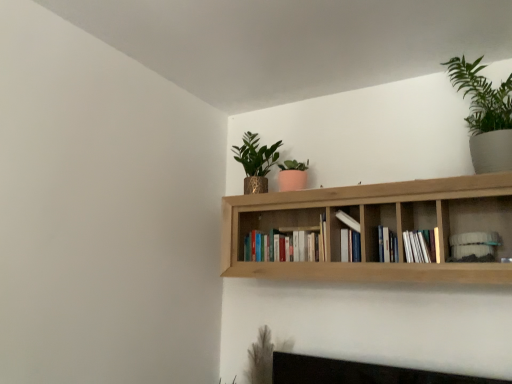
Question: Could natural wood bookshelf at upper center be considered to be inside white paper book at center-right, the second book when ordered from right to left?

Choices:
 (A) yes
 (B) no

Answer: (B)

Question: From a real-world perspective, is white paper book at center-right, the second book when ordered from right to left, over natural wood bookshelf at upper center?

Choices:
 (A) no
 (B) yes

Answer: (A)

Question: Does white paper book at center-right, arranged as the 4th book when viewed from the left, have a greater width compared to natural wood bookshelf at upper center?

Choices:
 (A) yes
 (B) no

Answer: (B)

Question: Is white paper book at center-right, arranged as the 4th book when viewed from the left, looking in the opposite direction of natural wood bookshelf at upper center?

Choices:
 (A) yes
 (B) no

Answer: (A)

Question: Could you tell me if white paper book at center-right, the second book when ordered from right to left, is turned towards natural wood bookshelf at upper center?

Choices:
 (A) yes
 (B) no

Answer: (A)

Question: Would you say natural wood bookshelf at upper center is inside or outside white matte bookshelf at upper right, the 1th book viewed from the right?

Choices:
 (A) inside
 (B) outside

Answer: (B)

Question: Is natural wood bookshelf at upper center wider or thinner than white matte bookshelf at upper right, the 5th book in the left-to-right sequence?

Choices:
 (A) thin
 (B) wide

Answer: (B)

Question: From the image's perspective, is natural wood bookshelf at upper center located above or below white matte bookshelf at upper right, the 5th book in the left-to-right sequence?

Choices:
 (A) above
 (B) below

Answer: (A)

Question: From a real-world perspective, is natural wood bookshelf at upper center positioned above or below white matte bookshelf at upper right, the 1th book viewed from the right?

Choices:
 (A) below
 (B) above

Answer: (B)

Question: Considering the positions of point (496, 238) and point (436, 256), is point (496, 238) closer or farther from the camera than point (436, 256)?

Choices:
 (A) farther
 (B) closer

Answer: (A)

Question: Is white matte bookshelf at upper right, the 5th book in the left-to-right sequence, to the left or to the right of white paper book at center-right, the second book when ordered from right to left, in the image?

Choices:
 (A) right
 (B) left

Answer: (A)

Question: From the image's perspective, relative to white paper book at center-right, arranged as the 4th book when viewed from the left, is white matte bookshelf at upper right, the 5th book in the left-to-right sequence, above or below?

Choices:
 (A) above
 (B) below

Answer: (B)

Question: From a real-world perspective, is white matte bookshelf at upper right, the 1th book viewed from the right, physically located above or below white paper book at center-right, the second book when ordered from right to left?

Choices:
 (A) above
 (B) below

Answer: (B)

Question: From the image's perspective, is natural wood bookshelf at upper center located above or below hardcover books at center, which is the first book from left to right?

Choices:
 (A) above
 (B) below

Answer: (A)

Question: Is natural wood bookshelf at upper center in front of or behind hardcover books at center, which is the first book from left to right, in the image?

Choices:
 (A) front
 (B) behind

Answer: (A)